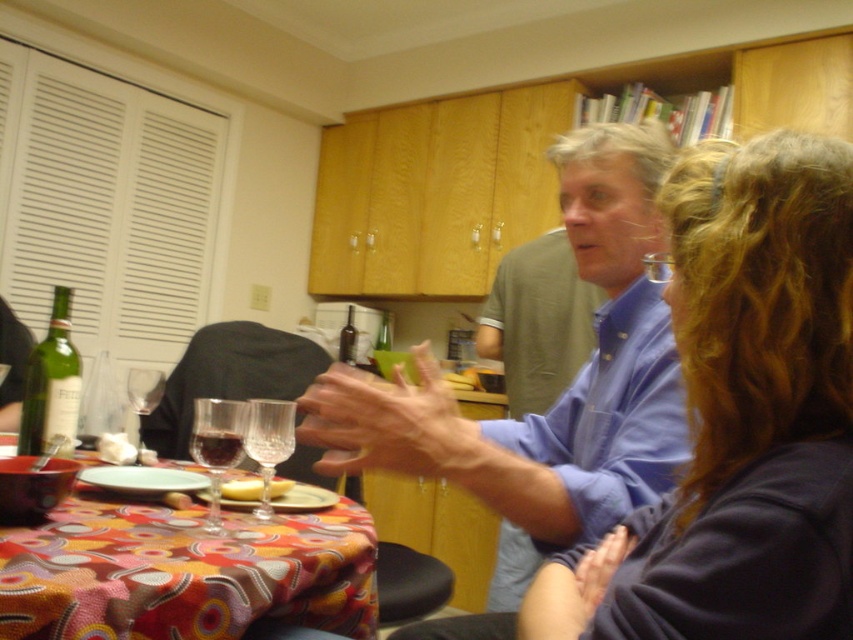
Question: Does translucent glass wine glass at table center come behind translucent glass wine at table center?

Choices:
 (A) no
 (B) yes

Answer: (A)

Question: Which object appears closest to the camera in this image?

Choices:
 (A) translucent glass wine glass at table center
 (B) translucent glass wine at table center

Answer: (A)

Question: Which is nearer to the transparent glass wine glass at table center?

Choices:
 (A) blue cotton shirt at center
 (B) yellow soft bread at table

Answer: (B)

Question: Which object appears closest to the camera in this image?

Choices:
 (A) patterned fabric tablecloth at center
 (B) translucent glass wine glass at table center
 (C) yellow soft bread at table
 (D) transparent glass wine glass at table center

Answer: (A)

Question: From the image, what is the correct spatial relationship of green glass bottle at table left in relation to translucent glass wine at table center?

Choices:
 (A) right
 (B) left

Answer: (B)

Question: Does blue cotton shirt at center have a smaller size compared to patterned fabric tablecloth at center?

Choices:
 (A) yes
 (B) no

Answer: (B)